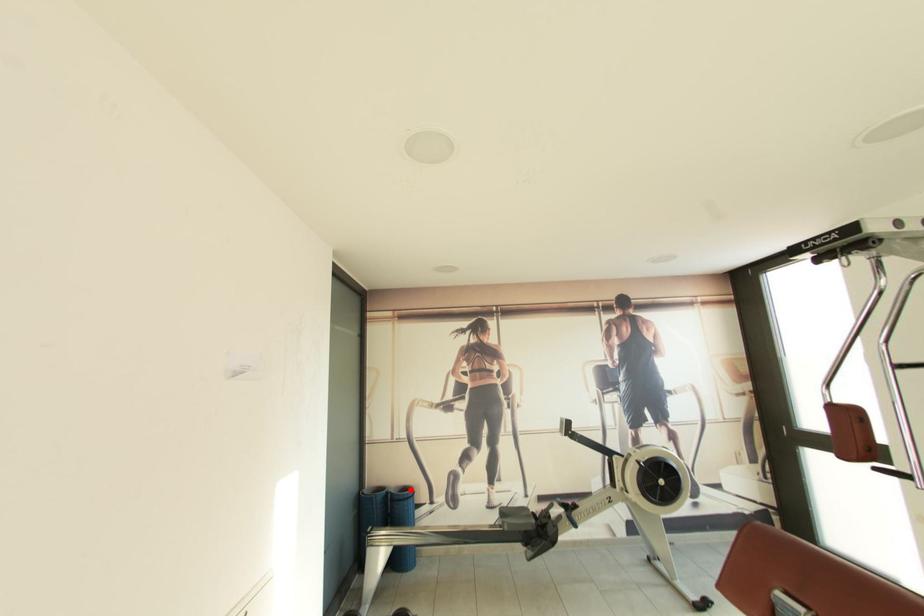
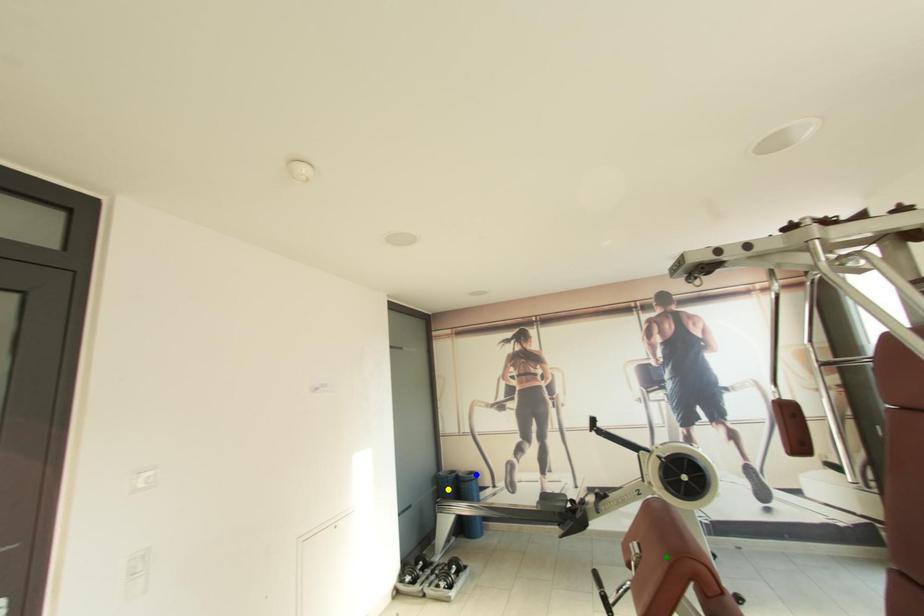
Question: I am providing you with two images of the same scene from different viewpoints. A red point is marked on the first image. You are given multiple points on the second image. Which point in image 2 is actually the same real-world point as the red point in image 1?

Choices:
 (A) yellow point
 (B) blue point
 (C) green point

Answer: (B)